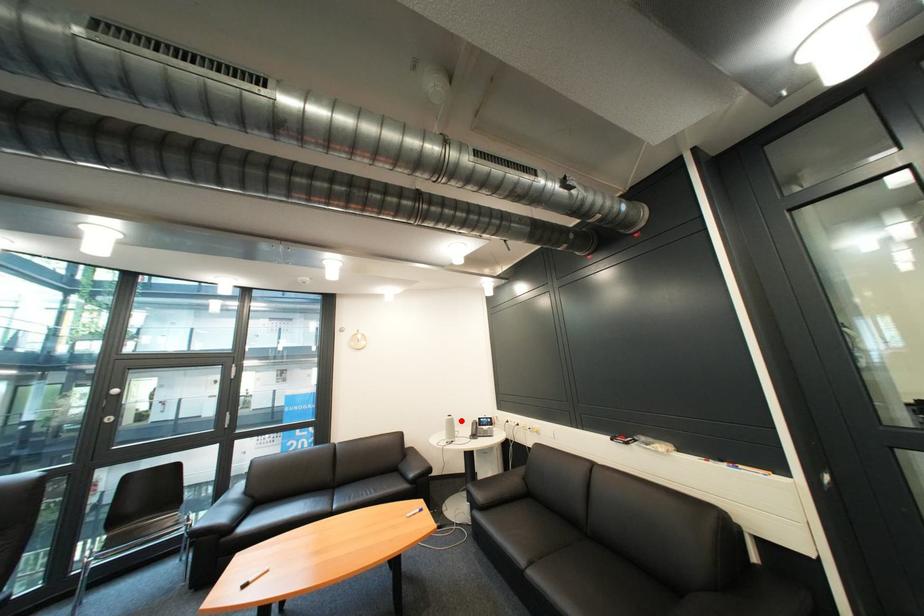
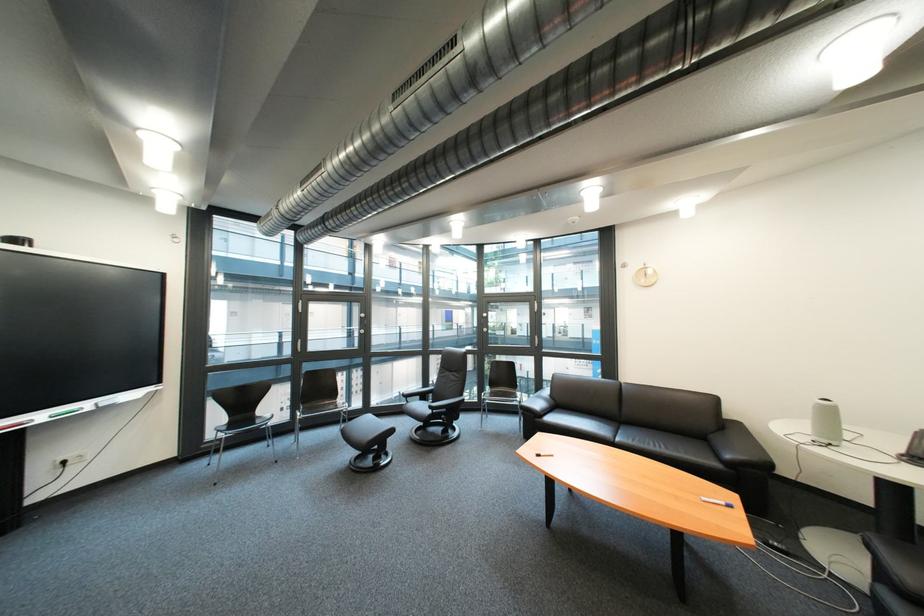
Question: A red point is marked in image1. In image2, is the corresponding 3D point closer to the camera or farther? Reply with the corresponding letter.

Choices:
 (A) The corresponding 3D point is closer.
 (B) The corresponding 3D point is farther.

Answer: (A)